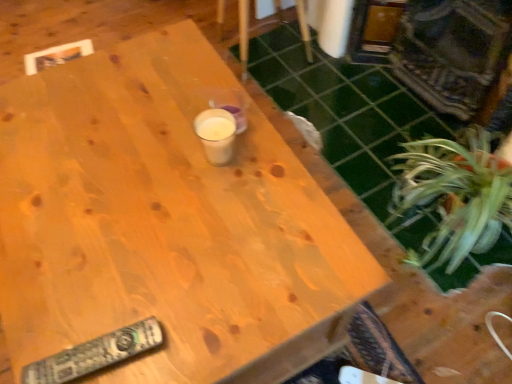
Question: From a real-world perspective, is black plastic remote at lower left physically located above or below wooden table at center?

Choices:
 (A) above
 (B) below

Answer: (A)

Question: From the image's perspective, is black plastic remote at lower left positioned above or below wooden table at center?

Choices:
 (A) below
 (B) above

Answer: (A)

Question: Estimate the real-world distances between objects in this image. Which object is closer to the green leafy plant at lower right?

Choices:
 (A) black plastic remote at lower left
 (B) wooden table at center
 (C) wooden chair at upper center

Answer: (B)

Question: Based on their relative distances, which object is nearer to the black plastic remote at lower left?

Choices:
 (A) wooden chair at upper center
 (B) green leafy plant at lower right
 (C) wooden table at center

Answer: (C)